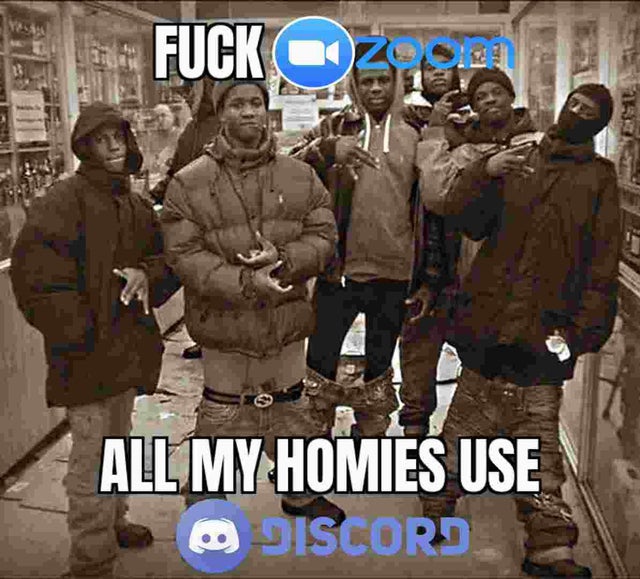
Find the location of a particular element. This screenshot has width=640, height=579. floor is located at coordinates (48, 538).